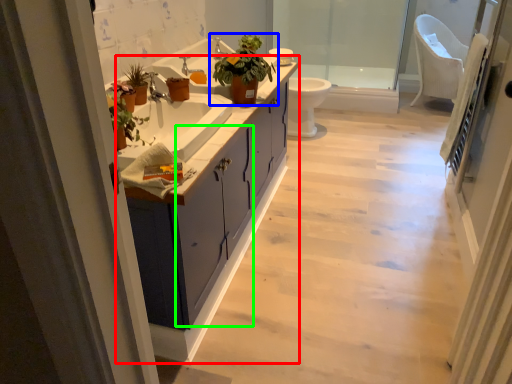
Question: Estimate the real-world distances between objects in this image. Which object is closer to bathroom cabinet (highlighted by a red box), houseplant (highlighted by a blue box) or cabinetry (highlighted by a green box)?

Choices:
 (A) houseplant
 (B) cabinetry

Answer: (B)